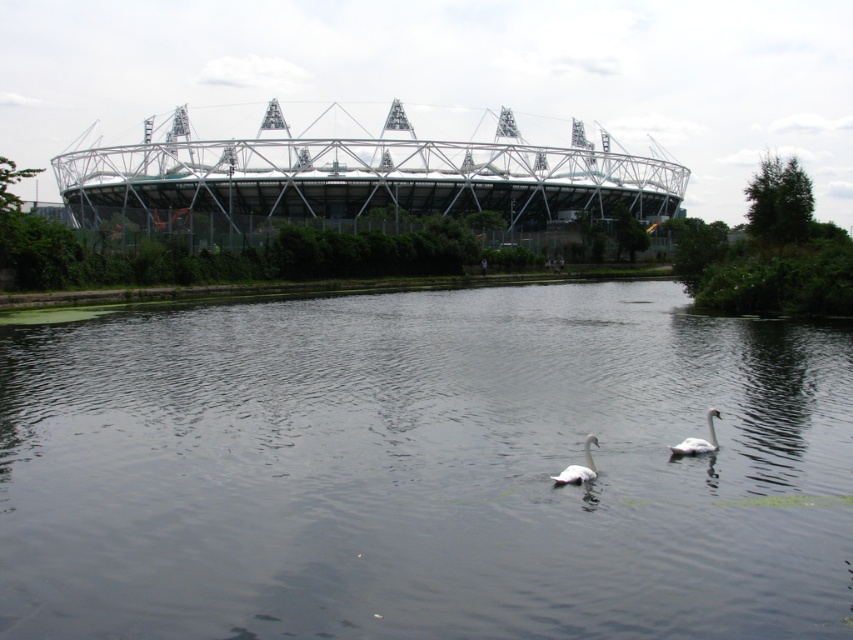
Question: Considering the relative positions of transparent water at center and white feathered swan at center in the image provided, where is transparent water at center located with respect to white feathered swan at center?

Choices:
 (A) below
 (B) above

Answer: (B)

Question: Which point is farther to the camera?

Choices:
 (A) (572, 481)
 (B) (682, 442)
 (C) (759, 602)

Answer: (B)

Question: Which point appears farthest from the camera in this image?

Choices:
 (A) (498, 400)
 (B) (718, 416)

Answer: (A)

Question: Is the position of transparent water at center less distant than that of white matte swan at lower center?

Choices:
 (A) no
 (B) yes

Answer: (B)

Question: Which point is closer to the camera?

Choices:
 (A) (287, 417)
 (B) (563, 470)
 (C) (708, 451)

Answer: (B)

Question: Can you confirm if transparent water at center is positioned to the left of white matte swan at lower center?

Choices:
 (A) no
 (B) yes

Answer: (B)